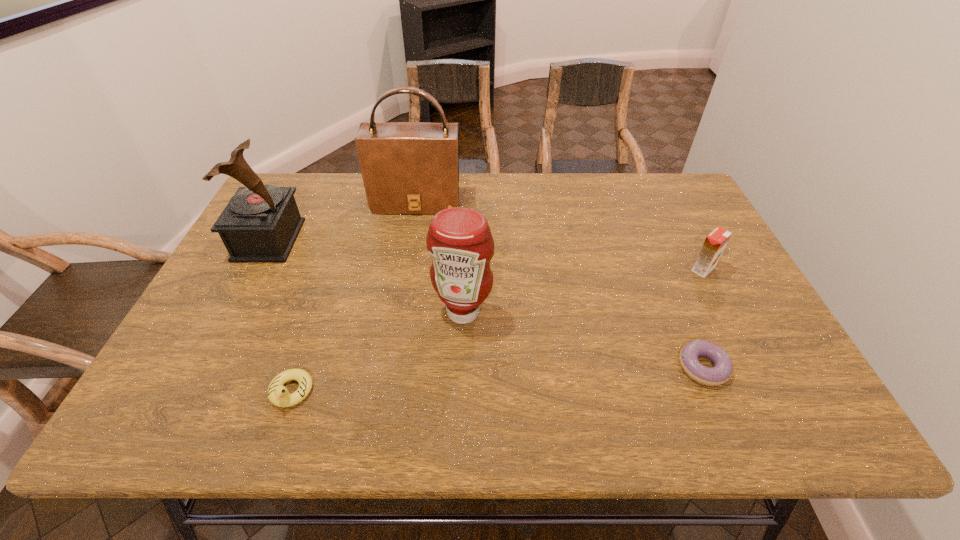
Identify the location of vacant area located at the horn opening of the leftmost object. The width and height of the screenshot is (960, 540). (429, 240).

Identify the location of blank area located on the left of the condiment. The image size is (960, 540). (290, 312).

Identify the location of vacant space located 0.050m on the back of the orange juice. (692, 248).

At what (x,y) coordinates should I click in order to perform the action: click on free location located on the right of the shortest object. Please return your answer as a coordinate pair (x, y). This screenshot has height=540, width=960. Looking at the image, I should click on (769, 367).

You are a GUI agent. You are given a task and a screenshot of the screen. Output one action in this format:
    pyautogui.click(x=<x>, y=<y>)
    Task: Click on the object that is positioned at the far edge
    
    Given the screenshot: What is the action you would take?
    pyautogui.click(x=407, y=167)

Locate an element on the screen. The width and height of the screenshot is (960, 540). object present at the near edge is located at coordinates (278, 395).

What are the coordinates of `object positioned at the left edge` in the screenshot? It's located at (260, 224).

Where is `orange juice that is at the right edge`? This screenshot has width=960, height=540. orange juice that is at the right edge is located at coordinates (715, 243).

At what (x,y) coordinates should I click in order to perform the action: click on doughnut situated at the right edge. Please return your answer as a coordinate pair (x, y). Looking at the image, I should click on click(723, 367).

In the image, there is a desktop. At what (x,y) coordinates should I click in order to perform the action: click on vacant area at the far edge. Please return your answer as a coordinate pair (x, y). The width and height of the screenshot is (960, 540). Looking at the image, I should click on (614, 196).